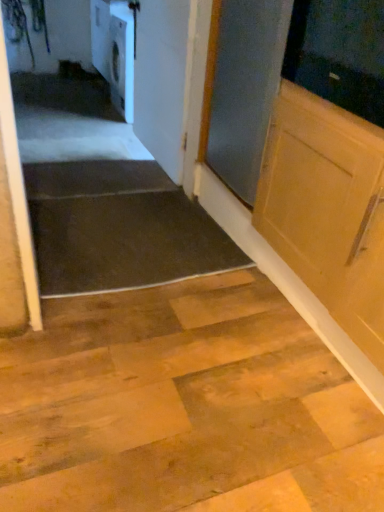
Question: Is dark rubber mat at lower left to the left of white glossy door at upper center from the viewer's perspective?

Choices:
 (A) yes
 (B) no

Answer: (A)

Question: From the image's perspective, would you say dark rubber mat at lower left is shown under white glossy door at upper center?

Choices:
 (A) no
 (B) yes

Answer: (B)

Question: Are dark rubber mat at lower left and white glossy door at upper center far apart?

Choices:
 (A) no
 (B) yes

Answer: (A)

Question: Can you confirm if dark rubber mat at lower left is taller than white glossy door at upper center?

Choices:
 (A) no
 (B) yes

Answer: (A)

Question: Is dark rubber mat at lower left turned away from white glossy door at upper center?

Choices:
 (A) yes
 (B) no

Answer: (B)

Question: Is point (175, 128) positioned closer to the camera than point (130, 40)?

Choices:
 (A) farther
 (B) closer

Answer: (B)

Question: Considering the positions of white glossy door at upper center and white glossy dishwasher at upper left in the image, is white glossy door at upper center taller or shorter than white glossy dishwasher at upper left?

Choices:
 (A) tall
 (B) short

Answer: (A)

Question: Choose the correct answer: Is white glossy door at upper center inside white glossy dishwasher at upper left or outside it?

Choices:
 (A) outside
 (B) inside

Answer: (A)

Question: In terms of width, does white glossy door at upper center look wider or thinner when compared to white glossy dishwasher at upper left?

Choices:
 (A) wide
 (B) thin

Answer: (B)

Question: Would you say dark rubber mat at lower left is inside or outside white glossy dishwasher at upper left?

Choices:
 (A) outside
 (B) inside

Answer: (A)

Question: Is dark rubber mat at lower left wider or thinner than white glossy dishwasher at upper left?

Choices:
 (A) thin
 (B) wide

Answer: (B)

Question: From the image's perspective, is dark rubber mat at lower left located above or below white glossy dishwasher at upper left?

Choices:
 (A) below
 (B) above

Answer: (A)

Question: Based on their positions, is dark rubber mat at lower left located to the left or right of white glossy dishwasher at upper left?

Choices:
 (A) left
 (B) right

Answer: (B)

Question: Is white glossy dishwasher at upper left spatially inside white glossy door at upper center, or outside of it?

Choices:
 (A) inside
 (B) outside

Answer: (B)

Question: Is white glossy dishwasher at upper left taller or shorter than white glossy door at upper center?

Choices:
 (A) short
 (B) tall

Answer: (A)